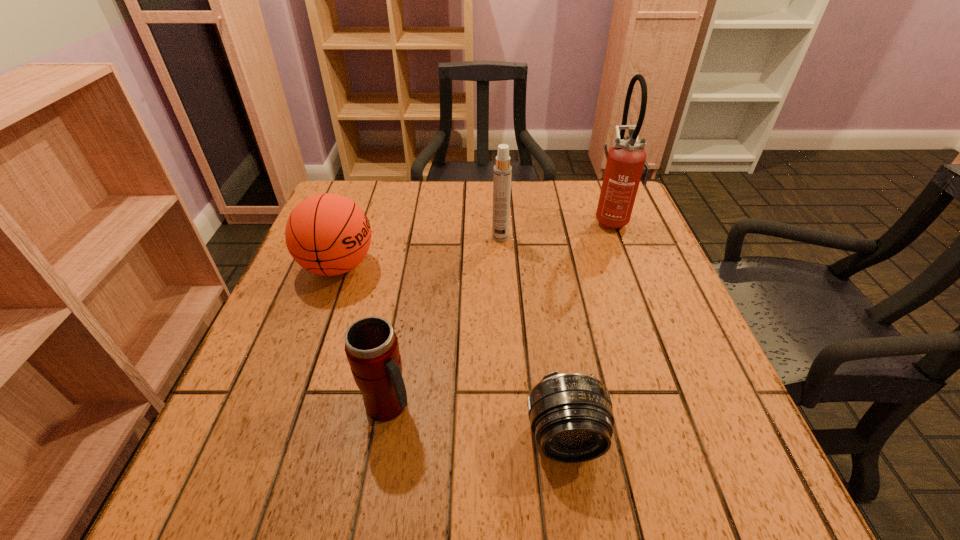
Where is `vacant space positioned at the nozzle of the rightmost object`? The image size is (960, 540). vacant space positioned at the nozzle of the rightmost object is located at coordinates (559, 219).

The height and width of the screenshot is (540, 960). What are the coordinates of `vacant space located on the front of the aerosol can` in the screenshot? It's located at (504, 303).

Where is `free space located 0.370m on the side with the handle of the second object from left to right`? This screenshot has height=540, width=960. free space located 0.370m on the side with the handle of the second object from left to right is located at coordinates (632, 406).

What are the coordinates of `vacant region located 0.120m on the side with logo of the basketball` in the screenshot? It's located at (428, 266).

You are a GUI agent. You are given a task and a screenshot of the screen. Output one action in this format:
    pyautogui.click(x=<x>, y=<y>)
    Task: Click on the object positioned at the far edge
    
    Given the screenshot: What is the action you would take?
    pyautogui.click(x=626, y=165)

Find the location of a particular element. The width and height of the screenshot is (960, 540). object located in the near edge section of the desktop is located at coordinates (571, 416).

Where is `object located in the left edge section of the desktop`? Image resolution: width=960 pixels, height=540 pixels. object located in the left edge section of the desktop is located at coordinates (327, 234).

The height and width of the screenshot is (540, 960). I want to click on object present at the right edge, so click(x=626, y=165).

At what (x,y) coordinates should I click in order to perform the action: click on object located in the far right corner section of the desktop. Please return your answer as a coordinate pair (x, y). This screenshot has width=960, height=540. Looking at the image, I should click on (626, 165).

The image size is (960, 540). I want to click on free space at the far edge, so click(x=430, y=208).